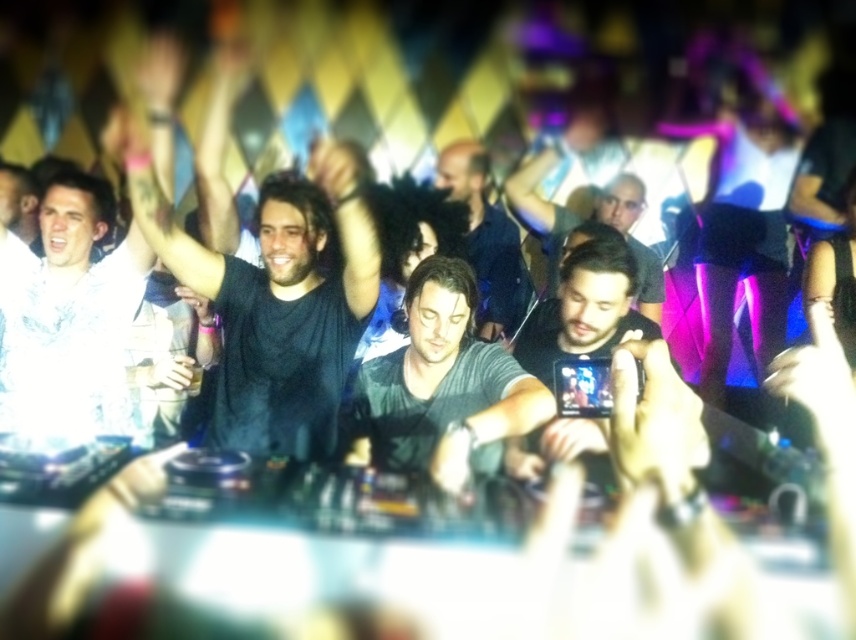
You are standing at the entrance of the nightclub and see the white cotton shirt at upper left and the dark blue shirt at center. Which one is positioned more to the left side?

The white cotton shirt at upper left is positioned more to the left side.

You are standing at the DJ booth and want to reach both points in the scene. Which point, point (75, 396) or point (393, 381), is closer to you?

Point (75, 396) is closer to the camera than point (393, 381), so you can reach it first.

You are a photographer at the nightclub. You want to take a photo that includes both the white cotton shirt at upper left and the dark blue shirt at center. Which shirt should you zoom in on more to ensure both are clearly visible?

The white cotton shirt at upper left is larger in size than the dark blue shirt at center, so you should zoom in on the dark blue shirt at center to balance their sizes in the photo.